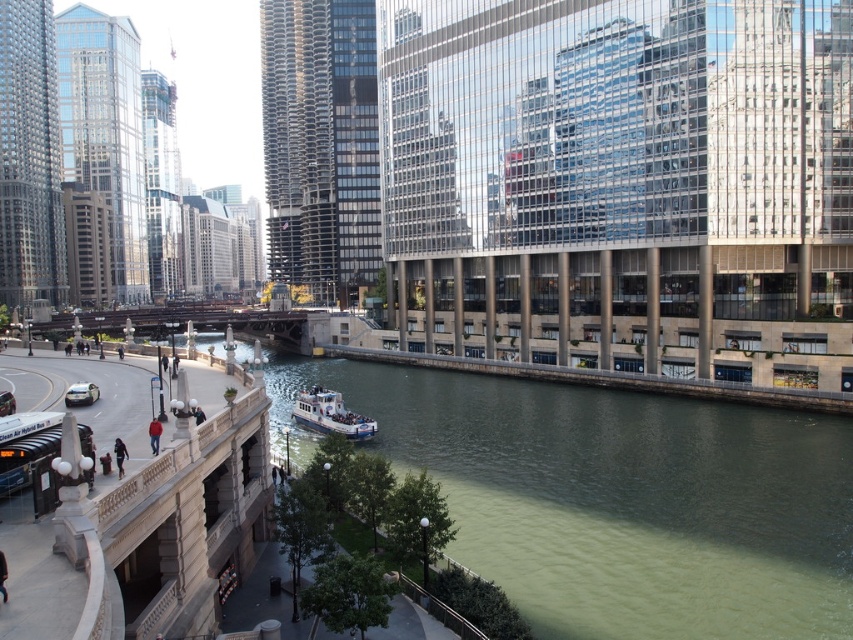
Can you confirm if white glossy boat at center is shorter than matte black car at lower left?

Incorrect, white glossy boat at center's height does not fall short of matte black car at lower left's.

Does white glossy boat at center appear under matte black car at lower left?

Yes.

Locate an element on the screen. Image resolution: width=853 pixels, height=640 pixels. white glossy boat at center is located at coordinates (329, 413).

In order to click on white glossy boat at center in this screenshot , I will do `click(329, 413)`.

Does greenish water at center have a lesser width compared to white glossy boat at center?

Incorrect, greenish water at center's width is not less than white glossy boat at center's.

Locate an element on the screen. The width and height of the screenshot is (853, 640). greenish water at center is located at coordinates (616, 499).

Is point (712, 476) behind point (363, 417)?

No.

Identify the location of greenish water at center. The width and height of the screenshot is (853, 640). (616, 499).

In the scene shown: Which of these two, greenish water at center or matte black car at lower left, stands shorter?

Standing shorter between the two is matte black car at lower left.

Is greenish water at center positioned before matte black car at lower left?

Yes, greenish water at center is closer to the viewer.

Which is behind, point (606, 566) or point (70, 388)?

Positioned behind is point (70, 388).

You are a GUI agent. You are given a task and a screenshot of the screen. Output one action in this format:
    pyautogui.click(x=<x>, y=<y>)
    Task: Click on the greenish water at center
    The width and height of the screenshot is (853, 640).
    Given the screenshot: What is the action you would take?
    pyautogui.click(x=616, y=499)